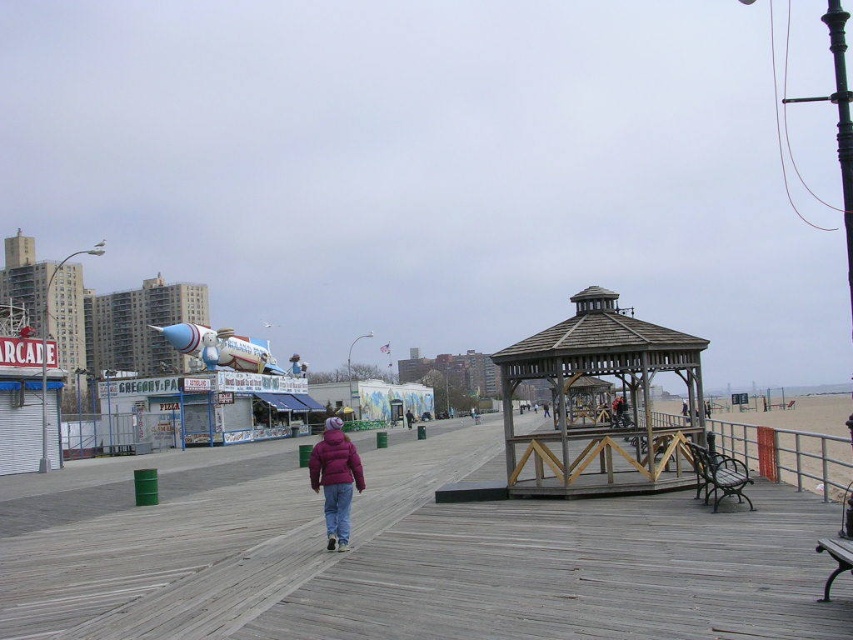
Is wooden at center wider than maroon puffy jacket at center?

Yes, wooden at center is wider than maroon puffy jacket at center.

Looking at this image, can you confirm if wooden at center is positioned above maroon puffy jacket at center?

No, wooden at center is not above maroon puffy jacket at center.

Locate an element on the screen. Image resolution: width=853 pixels, height=640 pixels. wooden at center is located at coordinates (422, 563).

At what (x,y) coordinates should I click in order to perform the action: click on wooden gazebo at center. Please return your answer as a coordinate pair (x, y). Looking at the image, I should click on (595, 422).

Who is more distant from viewer, (573, 456) or (325, 452)?

The point (573, 456) is behind.

This screenshot has height=640, width=853. Identify the location of wooden gazebo at center. (595, 422).

Between wooden gazebo at center and maroon puffy jacket at center, which one has more height?

wooden gazebo at center

What do you see at coordinates (595, 422) in the screenshot?
I see `wooden gazebo at center` at bounding box center [595, 422].

Locate an element on the screen. The width and height of the screenshot is (853, 640). wooden gazebo at center is located at coordinates (595, 422).